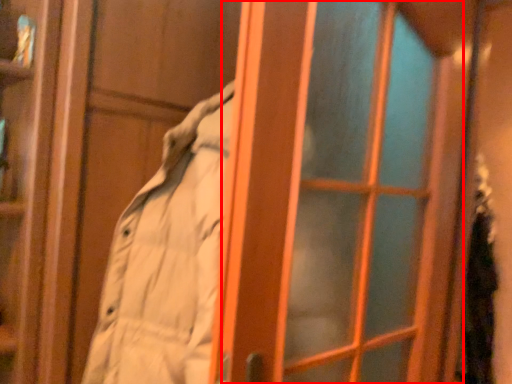
Question: From the image's perspective, what is the correct spatial positioning of screen door (annotated by the red box) in reference to person?

Choices:
 (A) above
 (B) below

Answer: (A)